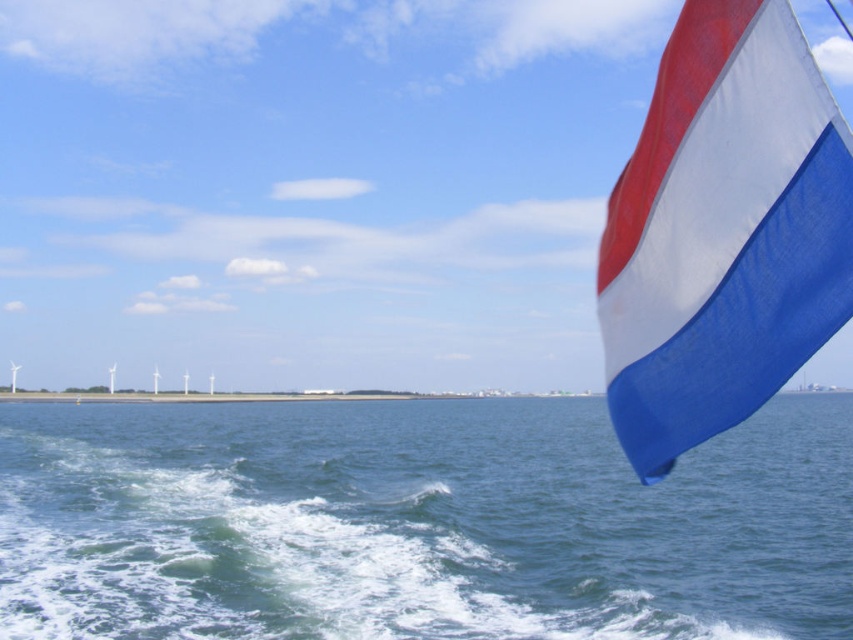
You are on a boat and need to determine the position of the blue water at lower right relative to the textured fabric flag at upper right. Which object is located to the right of the other?

The blue water at lower right is positioned on the right side of textured fabric flag at upper right, so the blue water at lower right is to the right of the textured fabric flag at upper right.

You are standing on the deck of a boat and see the blue water at lower right and the textured fabric flag at upper right. Which object appears taller from your viewpoint?

Answer: The blue water at lower right appears taller than the textured fabric flag at upper right based on their positions in the scene.

In the scene shown: You are standing on the deck of the ship and want to throw a lifebuoy to a person in the water. The coordinates of the lifebuoy are point [310,426]. If the person is 91.20 meters away from the lifebuoy, will they be able to reach it if the lifebuoy has a 100 meter throwing range?

The person is 91.20 meters away from the lifebuoy at point [310,426], which is within the 100 meter throwing range. Therefore, they can reach it.